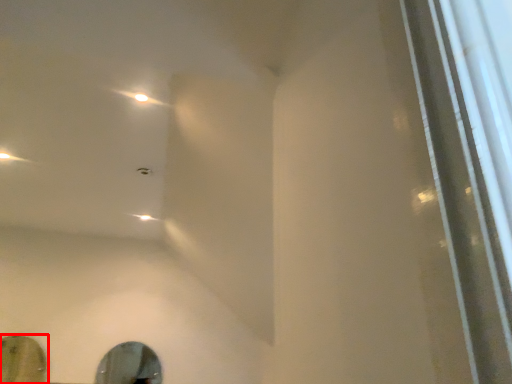
Question: From the image's perspective, where is mirror (annotated by the red box) located in relation to mirror in the image?

Choices:
 (A) below
 (B) above

Answer: (B)